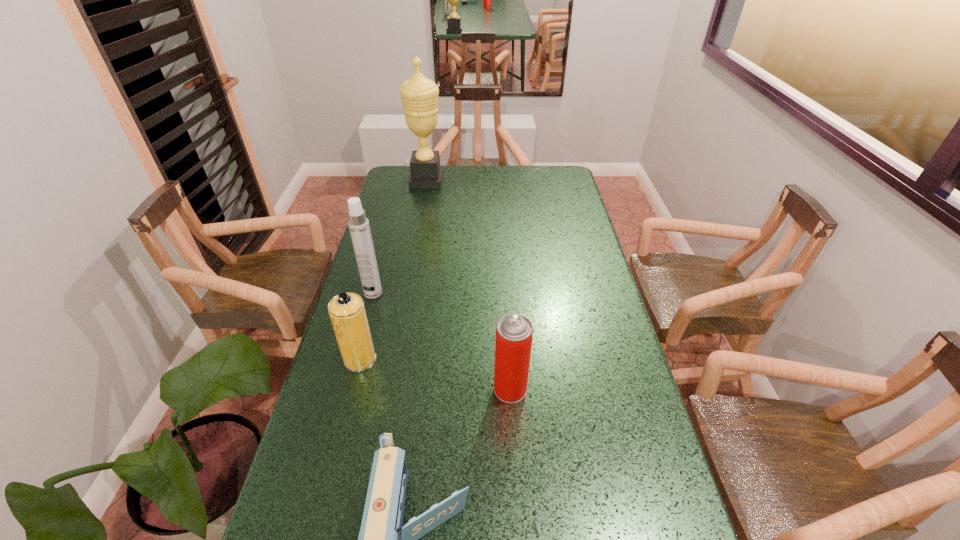
Where is `free space between the third nearest object and the nearest aerosol can`? The image size is (960, 540). free space between the third nearest object and the nearest aerosol can is located at coordinates (435, 374).

At what (x,y) coordinates should I click in order to perform the action: click on the closest object to the camcorder. Please return your answer as a coordinate pair (x, y). The width and height of the screenshot is (960, 540). Looking at the image, I should click on (514, 332).

Identify the location of object that is the fourth closest to the third farthest object. (419, 95).

Select which aerosol can is the third closest to the nearest object. Please provide its 2D coordinates. Your answer should be formatted as a tuple, i.e. [(x, y)], where the tuple contains the x and y coordinates of a point satisfying the conditions above.

[(358, 224)]

Locate which aerosol can is the closest to the third nearest object. Please provide its 2D coordinates. Your answer should be formatted as a tuple, i.e. [(x, y)], where the tuple contains the x and y coordinates of a point satisfying the conditions above.

[(358, 224)]

The image size is (960, 540). I want to click on blank area in the image that satisfies the following two spatial constraints: 1. on the front side of the tallest aerosol can; 2. on the right side of the rightmost aerosol can, so click(348, 389).